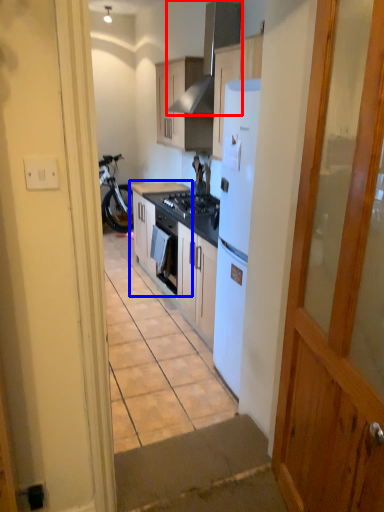
Question: Which object is closer to the camera taking this photo, kitchen appliance (highlighted by a red box) or cabinetry (highlighted by a blue box)?

Choices:
 (A) kitchen appliance
 (B) cabinetry

Answer: (A)